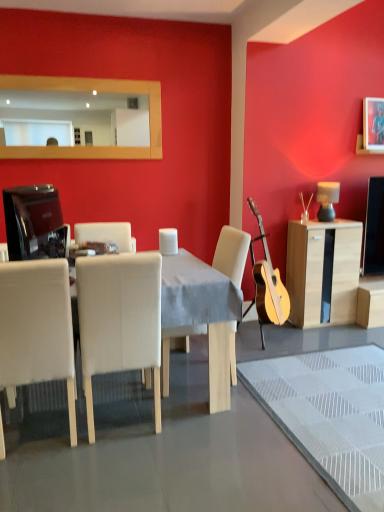
Question: Is the surface of matte black television at left in direct contact with wooden frame mirror at upper center?

Choices:
 (A) no
 (B) yes

Answer: (A)

Question: Considering the relative sizes of matte black television at left and wooden frame mirror at upper center in the image provided, is matte black television at left thinner than wooden frame mirror at upper center?

Choices:
 (A) yes
 (B) no

Answer: (B)

Question: Can you confirm if matte black television at left is wider than wooden frame mirror at upper center?

Choices:
 (A) yes
 (B) no

Answer: (A)

Question: From the image's perspective, does matte black television at left appear lower than wooden frame mirror at upper center?

Choices:
 (A) no
 (B) yes

Answer: (B)

Question: Considering the relative positions of matte black television at left and wooden frame mirror at upper center in the image provided, is matte black television at left in front of wooden frame mirror at upper center?

Choices:
 (A) no
 (B) yes

Answer: (B)

Question: Considering the relative positions of metallic silver picture frame at upper right and white fabric chair at center, positioned as the second chair in right-to-left order, in the image provided, is metallic silver picture frame at upper right to the left or to the right of white fabric chair at center, positioned as the second chair in right-to-left order,?

Choices:
 (A) left
 (B) right

Answer: (B)

Question: Considering the positions of metallic silver picture frame at upper right and white fabric chair at center, positioned as the second chair in right-to-left order, in the image, is metallic silver picture frame at upper right wider or thinner than white fabric chair at center, positioned as the second chair in right-to-left order,?

Choices:
 (A) thin
 (B) wide

Answer: (A)

Question: From the image's perspective, is metallic silver picture frame at upper right located above or below white fabric chair at center, the 2th chair when ordered from left to right?

Choices:
 (A) above
 (B) below

Answer: (A)

Question: Is metallic silver picture frame at upper right inside or outside of white fabric chair at center, the 2th chair when ordered from left to right?

Choices:
 (A) outside
 (B) inside

Answer: (A)

Question: From a real-world perspective, is white leather table at center physically located above or below matte black television at left?

Choices:
 (A) below
 (B) above

Answer: (A)

Question: Considering their positions, is white leather table at center located in front of or behind matte black television at left?

Choices:
 (A) behind
 (B) front

Answer: (B)

Question: Is point (162, 278) positioned closer to the camera than point (11, 211)?

Choices:
 (A) farther
 (B) closer

Answer: (A)

Question: Visually, is white leather table at center positioned to the left or to the right of matte black television at left?

Choices:
 (A) left
 (B) right

Answer: (B)

Question: Considering their positions, is white fabric chair at center, which ranks as the first chair in right-to-left order, located in front of or behind wooden frame mirror at upper center?

Choices:
 (A) behind
 (B) front

Answer: (B)

Question: Considering the positions of white fabric chair at center, the 3th chair when ordered from left to right, and wooden frame mirror at upper center in the image, is white fabric chair at center, the 3th chair when ordered from left to right, taller or shorter than wooden frame mirror at upper center?

Choices:
 (A) tall
 (B) short

Answer: (A)